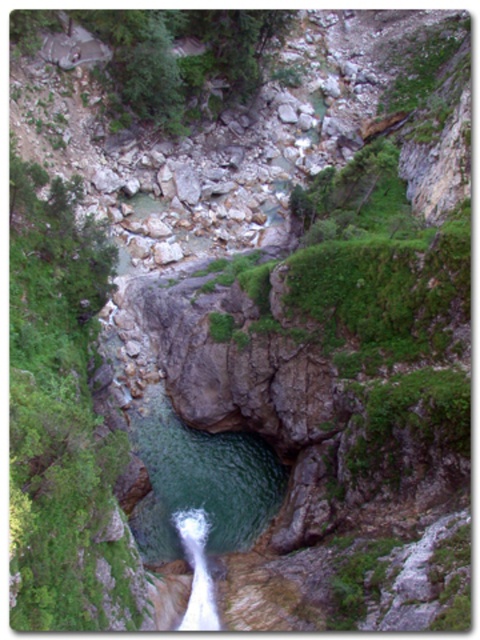
You are a hiker who wants to cross the white frothy water at center. You see the green mossy rock at left nearby. Which direction should you go to avoid the water?

The green mossy rock at left is positioned on the left side of white frothy water at center, so you should go towards the left to avoid the water.

You are a hiker who wants to cross the canyon. You see the green mossy rock at left and the white frothy water at center. Which object would be a safer stepping stone for crossing?

The green mossy rock at left is larger in size than the white frothy water at center, making it a safer stepping stone for crossing.